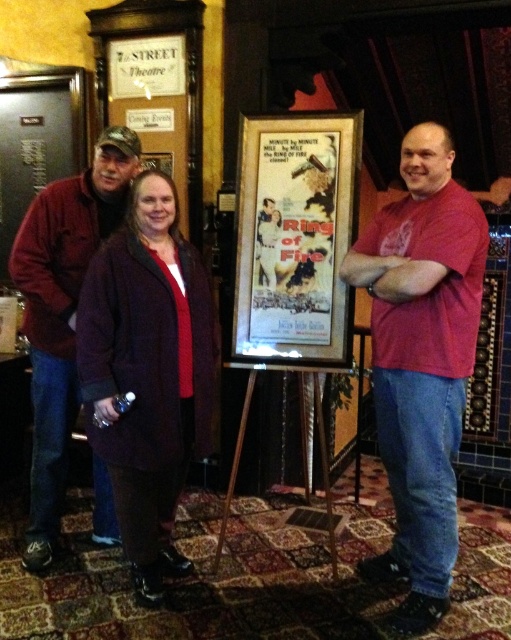
Is red matte shirt at center below vintage paper poster at center?

Correct, red matte shirt at center is located below vintage paper poster at center.

You are a GUI agent. You are given a task and a screenshot of the screen. Output one action in this format:
    pyautogui.click(x=<x>, y=<y>)
    Task: Click on the red matte shirt at center
    The image size is (511, 640).
    Given the screenshot: What is the action you would take?
    pyautogui.click(x=422, y=362)

Is dark purple wool coat at center shorter than maroon fleece jacket at center?

Yes, dark purple wool coat at center is shorter than maroon fleece jacket at center.

Can you confirm if dark purple wool coat at center is smaller than maroon fleece jacket at center?

Correct, dark purple wool coat at center occupies less space than maroon fleece jacket at center.

Where is `dark purple wool coat at center`? This screenshot has height=640, width=511. dark purple wool coat at center is located at coordinates (148, 372).

I want to click on red matte shirt at center, so click(422, 362).

Can you confirm if red matte shirt at center is positioned to the right of maroon fleece jacket at center?

Yes, red matte shirt at center is to the right of maroon fleece jacket at center.

This screenshot has height=640, width=511. I want to click on red matte shirt at center, so coord(422,362).